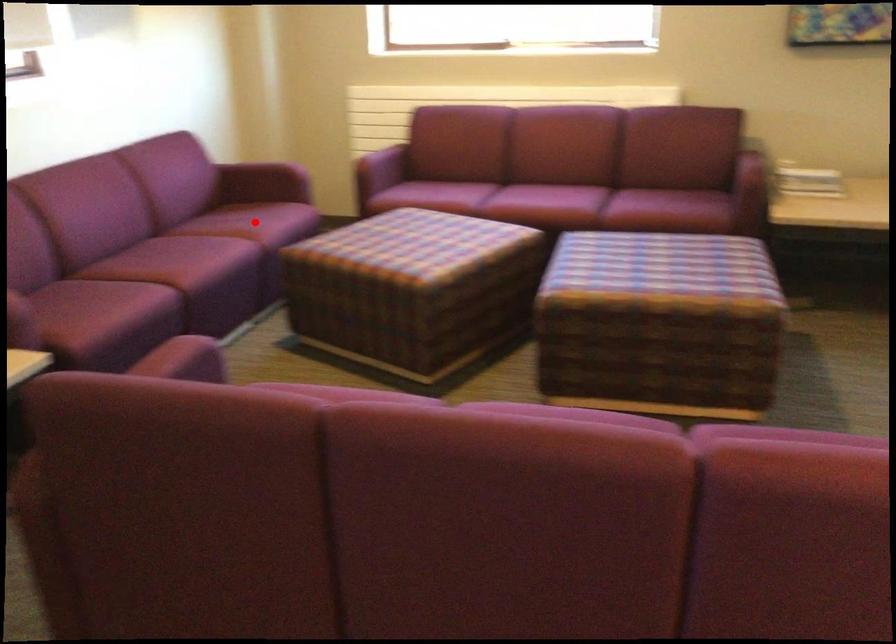
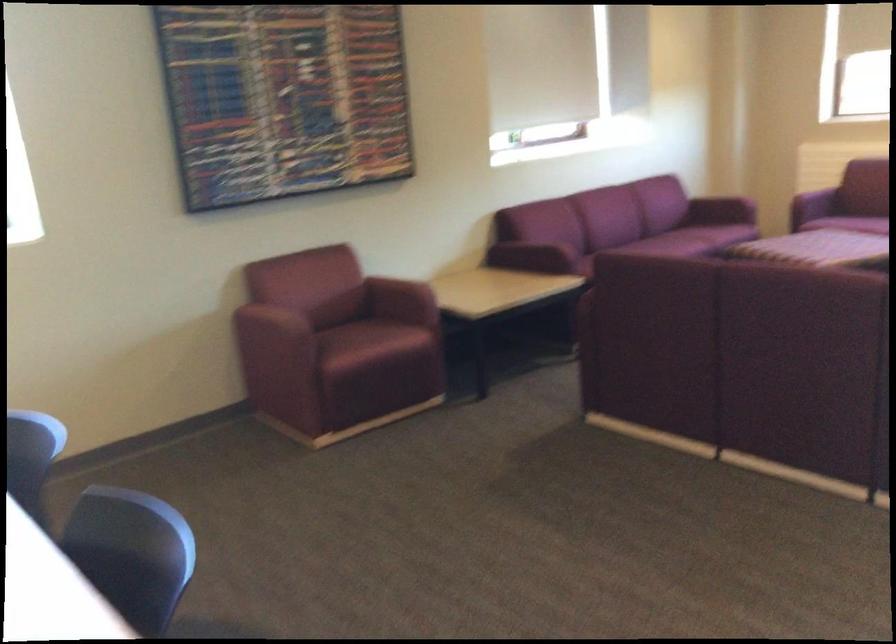
Question: I am providing you with two images of the same scene from different viewpoints. A red point is marked on the first image. Can you still see the location of the red point in image 2?

Choices:
 (A) Yes
 (B) No

Answer: (B)